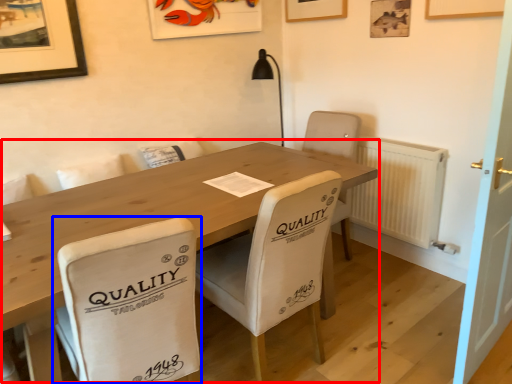
Question: Which point is closer to the camera, table (highlighted by a red box) or chair (highlighted by a blue box)?

Choices:
 (A) table
 (B) chair

Answer: (B)